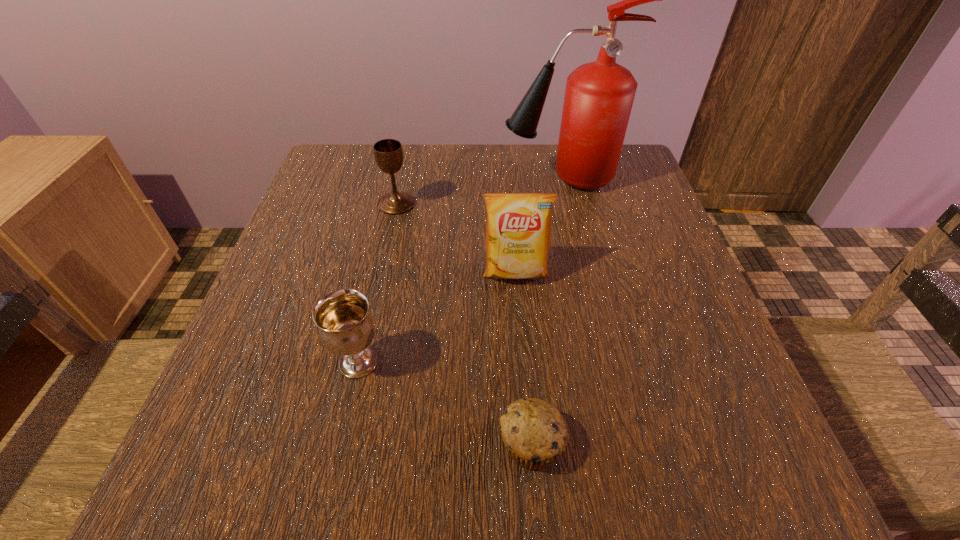
Find the location of a particular element. free location that satisfies the following two spatial constraints: 1. on the back side of the nearer chalice; 2. on the left side of the farther chalice is located at coordinates (395, 204).